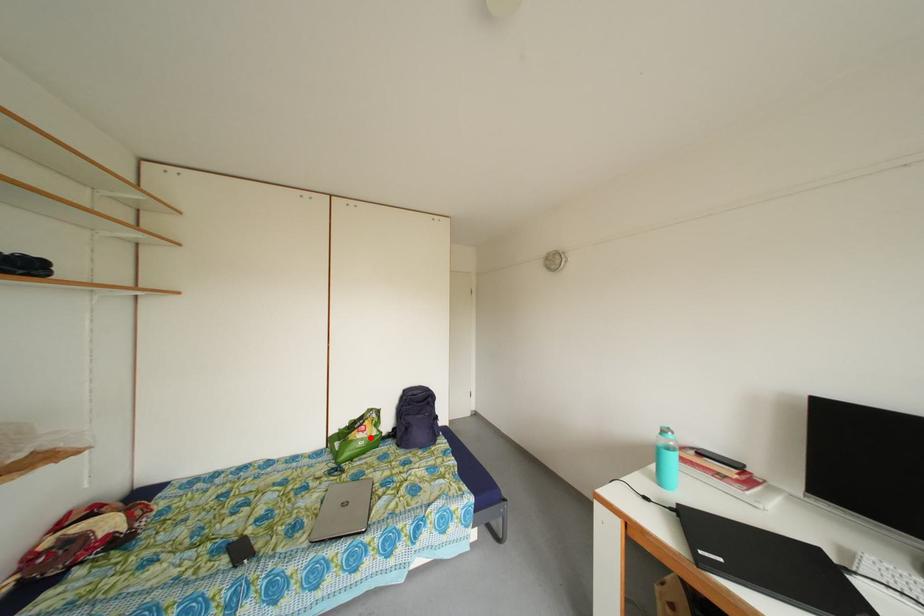
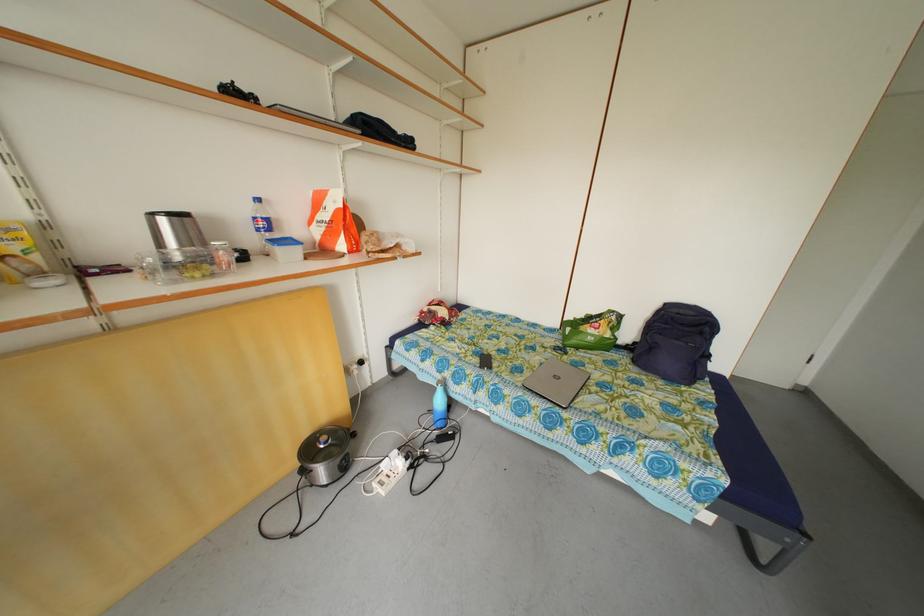
Where in the second image is the point corresponding to the highlighted location from the first image?

(602, 334)